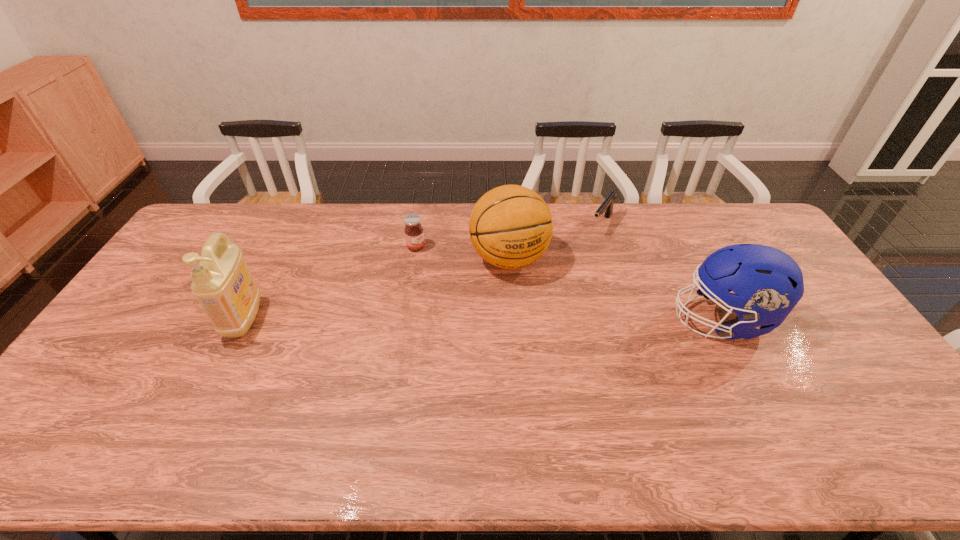
Image resolution: width=960 pixels, height=540 pixels. Identify the location of vacant area between the football helmet and the second object from left to right. (568, 283).

The width and height of the screenshot is (960, 540). I want to click on vacant area that lies between the football helmet and the jam, so click(568, 283).

The image size is (960, 540). Find the location of `vacant region between the third object from right to left and the rightmost object`. vacant region between the third object from right to left and the rightmost object is located at coordinates (615, 289).

Find the location of `unoccupied area between the football helmet and the detergent`. unoccupied area between the football helmet and the detergent is located at coordinates (483, 319).

The height and width of the screenshot is (540, 960). Identify the location of vacant area that lies between the pistol and the basketball. (555, 242).

This screenshot has height=540, width=960. In order to click on unoccupied area between the fourth object from left to right and the detergent in this screenshot , I will do `click(423, 272)`.

Point out which object is positioned as the fourth nearest to the jam. Please provide its 2D coordinates. Your answer should be formatted as a tuple, i.e. [(x, y)], where the tuple contains the x and y coordinates of a point satisfying the conditions above.

[(768, 283)]

Select which object is the fourth closest to the football helmet. Please provide its 2D coordinates. Your answer should be formatted as a tuple, i.e. [(x, y)], where the tuple contains the x and y coordinates of a point satisfying the conditions above.

[(222, 283)]